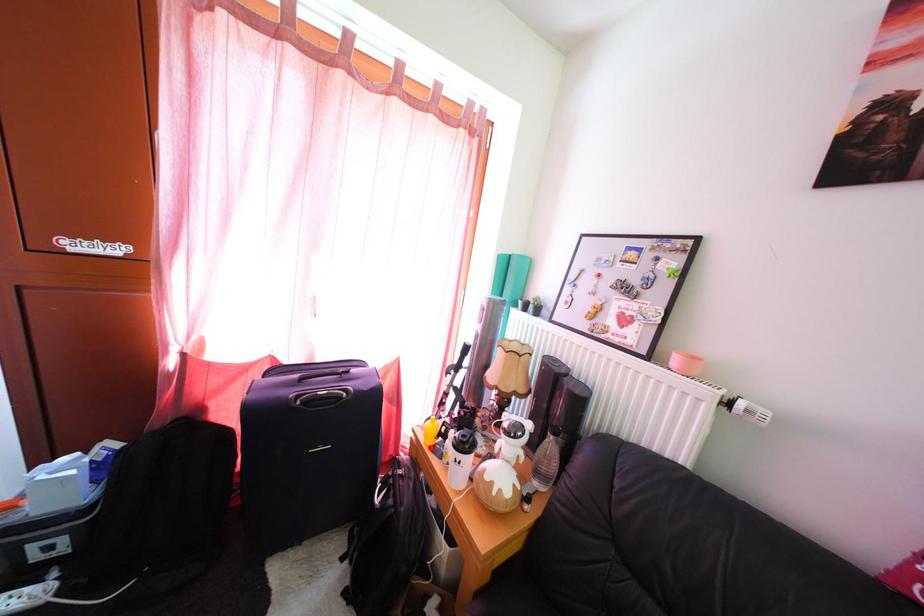
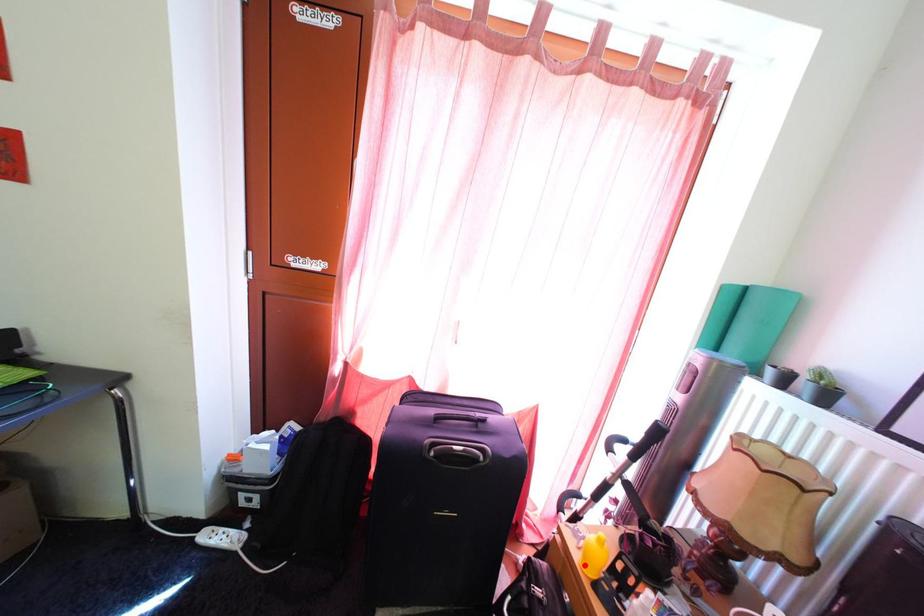
I am providing you with two images of the same scene from different viewpoints. A red point is marked on the first image and another point is marked on the second image. Are the points marked in image1 and image2 representing the same 3D position?

Yes